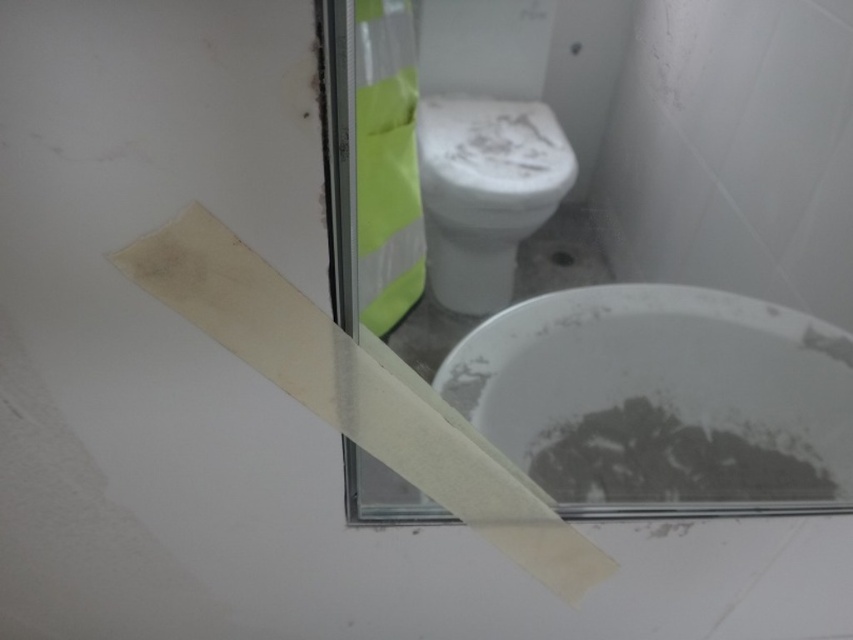
You are a cleaning inspector checking the bathroom. You see the white matte toilet paper at center and the white glossy toilet bowl at center. Which object is wider?

The white matte toilet paper at center is wider than the white glossy toilet bowl at center.

You are standing in front of the bathroom mirror and see two points marked on the reflective surface. The first point is at coordinate point (688, 408) and the second is at point (161, 291). Which point is closer to your eyes?

Point (688, 408) is further to the camera than point (161, 291), so the point closer to your eyes is point (161, 291).

Consider the image. You are a cleaning inspector checking the bathroom. You see the white matte toilet bowl at lower right and the white matte toilet paper at center. Which object is located to the right of the other?

The white matte toilet bowl at lower right is positioned on the right side of white matte toilet paper at center.